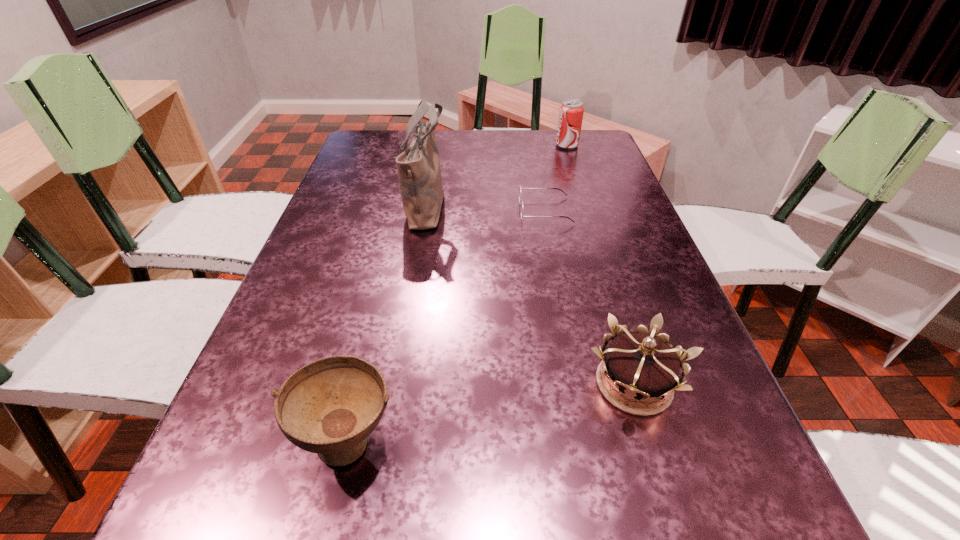
Locate an element on the screen. This screenshot has width=960, height=540. shoulder bag is located at coordinates (418, 166).

At what (x,y) coordinates should I click in order to perform the action: click on the farthest object. Please return your answer as a coordinate pair (x, y). This screenshot has height=540, width=960. Looking at the image, I should click on (571, 112).

Identify the location of soup bowl. (330, 406).

The width and height of the screenshot is (960, 540). I want to click on crown, so click(x=642, y=365).

Locate an element on the screen. This screenshot has width=960, height=540. the shortest object is located at coordinates (520, 199).

This screenshot has height=540, width=960. In order to click on blank area located on the front-facing side of the tallest object in this screenshot , I will do coord(577,206).

What are the coordinates of `vacant space positioned 0.270m on the left of the soda can` in the screenshot? It's located at (474, 145).

What are the coordinates of `vacant position located 0.300m on the right of the soup bowl` in the screenshot? It's located at (591, 438).

You are a GUI agent. You are given a task and a screenshot of the screen. Output one action in this format:
    pyautogui.click(x=<x>, y=<y>)
    Task: Click on the vacant space located 0.090m on the back of the crown
    
    Given the screenshot: What is the action you would take?
    pyautogui.click(x=612, y=313)

At what (x,y) coordinates should I click in order to perform the action: click on vacant region located 0.390m on the front-facing side of the spectacles. Please return your answer as a coordinate pair (x, y). The image size is (960, 540). Looking at the image, I should click on (372, 211).